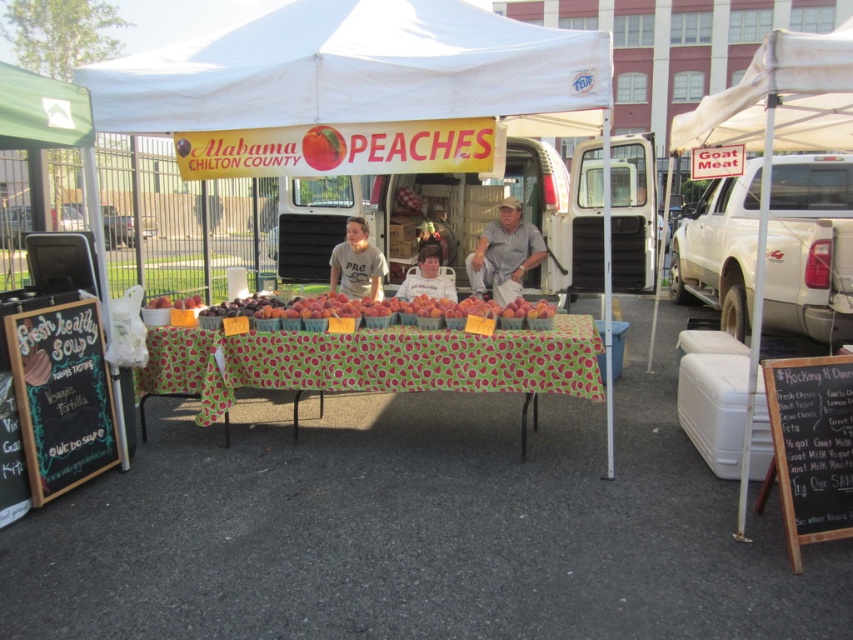
Between white fabric tent at center and white fabric tent at right, which one is positioned higher?

white fabric tent at center is higher up.

Does white fabric tent at center have a greater width compared to white fabric tent at right?

Yes, white fabric tent at center is wider than white fabric tent at right.

What are the coordinates of `white fabric tent at center` in the screenshot? It's located at (354, 68).

Between white fabric tent at right and black chalkboard at left, which one is positioned higher?

white fabric tent at right is higher up.

In the scene shown: Does white fabric tent at right have a lesser width compared to black chalkboard at left?

In fact, white fabric tent at right might be wider than black chalkboard at left.

Is point (836, 100) behind point (99, 346)?

Yes, it is.

I want to click on white fabric tent at right, so click(776, 141).

Does gray cotton shirt at center have a greater height compared to white fabric shirt at center?

Yes.

Can you confirm if gray cotton shirt at center is positioned below white fabric shirt at center?

No, gray cotton shirt at center is not below white fabric shirt at center.

Which is in front, point (357, 285) or point (427, 250)?

Positioned in front is point (427, 250).

Identify the location of gray cotton shirt at center. The height and width of the screenshot is (640, 853). (357, 262).